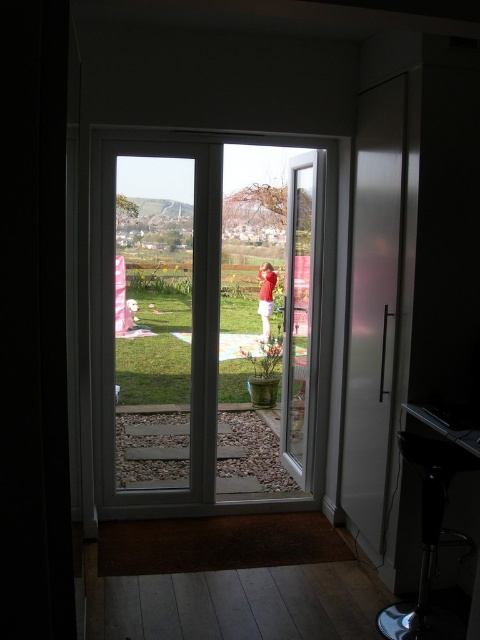
At what (x,y) coordinates should I click in order to perform the action: click on transparent glass door at center. Please return your answer as a coordinate pair (x, y). Image resolution: width=480 pixels, height=640 pixels. Looking at the image, I should click on (210, 323).

Is point (109, 324) closer to camera compared to point (370, 332)?

That is False.

At what (x,y) coordinates should I click in order to perform the action: click on transparent glass door at center. Please return your answer as a coordinate pair (x, y). The width and height of the screenshot is (480, 640). Looking at the image, I should click on (210, 323).